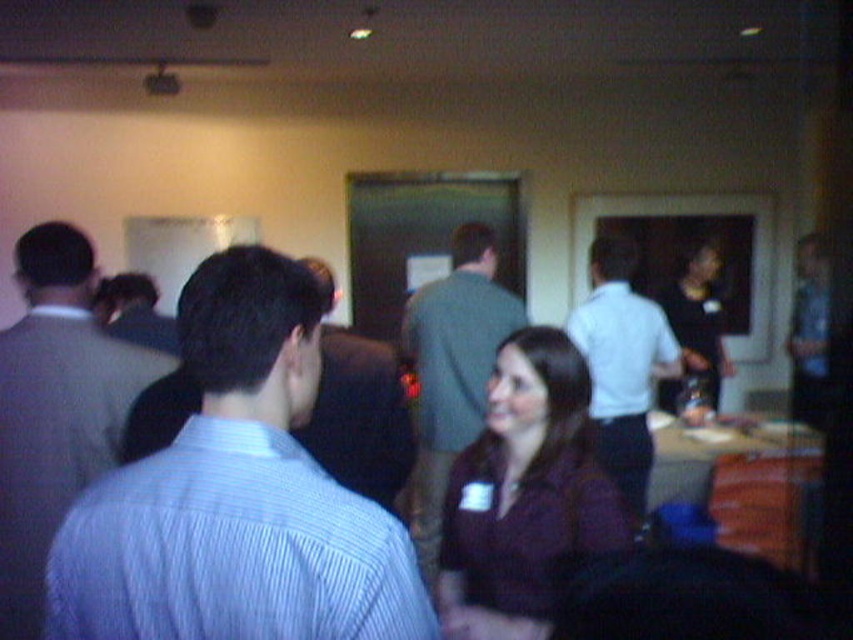
Question: Among these objects, which one is farthest from the camera?

Choices:
 (A) gray striped shirt at center
 (B) maroon fabric shirt at center
 (C) green fabric shirt at center

Answer: (A)

Question: Is the position of blue striped shirt at center less distant than that of white shirt at center?

Choices:
 (A) yes
 (B) no

Answer: (A)

Question: Among these points, which one is farthest from the camera?

Choices:
 (A) 679,301
 (B) 424,572
 (C) 79,484

Answer: (A)

Question: Is blue striped shirt at center positioned before white shirt at center?

Choices:
 (A) no
 (B) yes

Answer: (B)

Question: Based on their relative distances, which object is farther from the blue striped shirt at center?

Choices:
 (A) matte black shirt at center
 (B) white shirt at center
 (C) maroon fabric shirt at center

Answer: (A)

Question: Is striped cotton shirt at left to the left of gray striped shirt at center from the viewer's perspective?

Choices:
 (A) yes
 (B) no

Answer: (B)